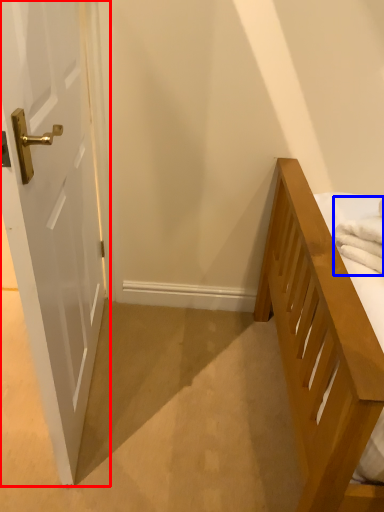
Question: Among these objects, which one is farthest to the camera, door (highlighted by a red box) or bath towel (highlighted by a blue box)?

Choices:
 (A) door
 (B) bath towel

Answer: (B)